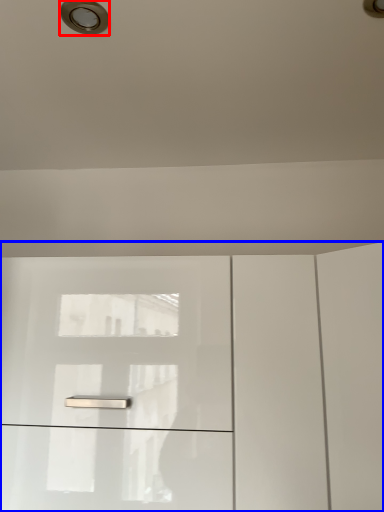
Question: Among these objects, which one is farthest to the camera, droplight (highlighted by a red box) or dresser (highlighted by a blue box)?

Choices:
 (A) droplight
 (B) dresser

Answer: (B)